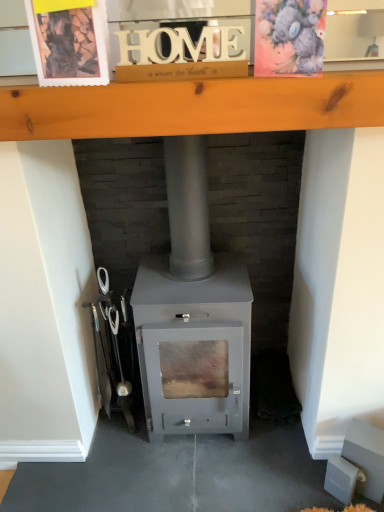
Question: Can we say wooden at upper center lies outside watercolor paper postcard at upper right, the 1th postcard in the right-to-left sequence?

Choices:
 (A) no
 (B) yes

Answer: (B)

Question: Considering the relative sizes of wooden at upper center and watercolor paper postcard at upper right, acting as the second postcard starting from the left, in the image provided, is wooden at upper center taller than watercolor paper postcard at upper right, acting as the second postcard starting from the left,?

Choices:
 (A) no
 (B) yes

Answer: (A)

Question: Are wooden at upper center and watercolor paper postcard at upper right, the 1th postcard in the right-to-left sequence, far apart?

Choices:
 (A) no
 (B) yes

Answer: (A)

Question: Would you say wooden at upper center contains watercolor paper postcard at upper right, the 1th postcard in the right-to-left sequence?

Choices:
 (A) no
 (B) yes

Answer: (A)

Question: Does wooden at upper center appear on the left side of watercolor paper postcard at upper right, acting as the second postcard starting from the left?

Choices:
 (A) no
 (B) yes

Answer: (B)

Question: Does wooden at upper center turn towards watercolor paper postcard at upper right, acting as the second postcard starting from the left?

Choices:
 (A) no
 (B) yes

Answer: (A)

Question: Does wooden postcard at upper left, the second postcard viewed from the right, have a greater width compared to watercolor paper postcard at upper right, acting as the second postcard starting from the left?

Choices:
 (A) yes
 (B) no

Answer: (B)

Question: Is wooden postcard at upper left, acting as the 1th postcard starting from the left, taller than watercolor paper postcard at upper right, acting as the second postcard starting from the left?

Choices:
 (A) no
 (B) yes

Answer: (B)

Question: Considering the relative sizes of wooden postcard at upper left, the second postcard viewed from the right, and watercolor paper postcard at upper right, the 1th postcard in the right-to-left sequence, in the image provided, is wooden postcard at upper left, the second postcard viewed from the right, thinner than watercolor paper postcard at upper right, the 1th postcard in the right-to-left sequence,?

Choices:
 (A) no
 (B) yes

Answer: (B)

Question: Is wooden postcard at upper left, the second postcard viewed from the right, aimed at watercolor paper postcard at upper right, acting as the second postcard starting from the left?

Choices:
 (A) yes
 (B) no

Answer: (B)

Question: From a real-world perspective, is wooden postcard at upper left, the second postcard viewed from the right, over watercolor paper postcard at upper right, the 1th postcard in the right-to-left sequence?

Choices:
 (A) yes
 (B) no

Answer: (A)

Question: From a real-world perspective, is wooden postcard at upper left, the second postcard viewed from the right, beneath watercolor paper postcard at upper right, the 1th postcard in the right-to-left sequence?

Choices:
 (A) no
 (B) yes

Answer: (A)

Question: Is matte gray wood burning stove at center located outside watercolor paper postcard at upper right, the 1th postcard in the right-to-left sequence?

Choices:
 (A) no
 (B) yes

Answer: (B)